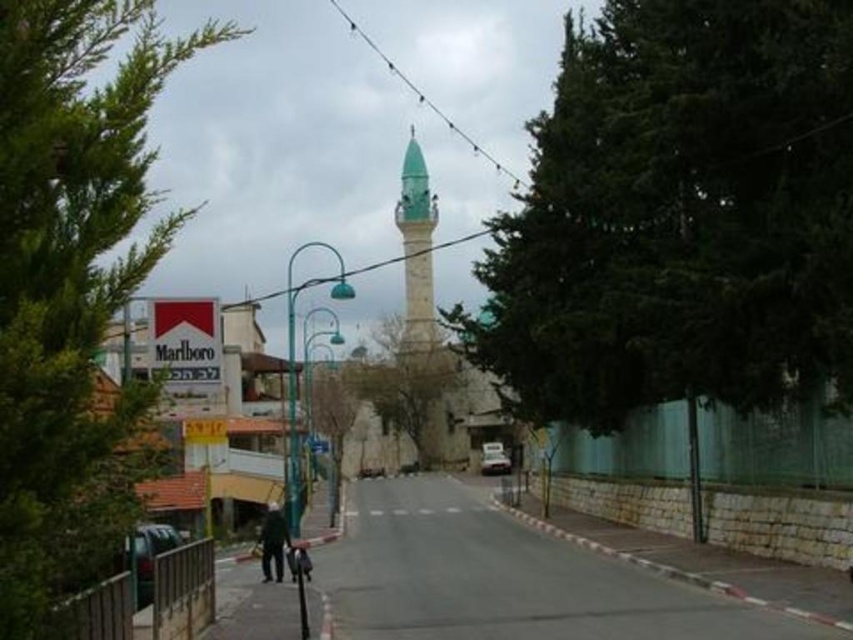
Can you confirm if green leafy tree at left is smaller than dark gray fabric jacket at center?

No, green leafy tree at left is not smaller than dark gray fabric jacket at center.

Describe the element at coordinates (70, 280) in the screenshot. I see `green leafy tree at left` at that location.

Which is behind, point (148, 236) or point (263, 561)?

The point (263, 561) is behind.

Identify the location of green leafy tree at left. (70, 280).

Can you confirm if green leafy tree at left is positioned above green stone minaret at center?

No, green leafy tree at left is not above green stone minaret at center.

Does green leafy tree at left have a lesser height compared to green stone minaret at center?

Indeed, green leafy tree at left has a lesser height compared to green stone minaret at center.

What do you see at coordinates (70, 280) in the screenshot? This screenshot has height=640, width=853. I see `green leafy tree at left` at bounding box center [70, 280].

Locate an element on the screen. The image size is (853, 640). green leafy tree at left is located at coordinates (70, 280).

Is point (628, 282) farther from camera compared to point (280, 532)?

Yes.

Based on the photo, does green leafy tree at upper center have a lesser height compared to dark gray fabric jacket at center?

Incorrect, green leafy tree at upper center's height does not fall short of dark gray fabric jacket at center's.

Who is more forward, (793, 67) or (271, 525)?

Point (793, 67) is more forward.

I want to click on green leafy tree at upper center, so click(680, 218).